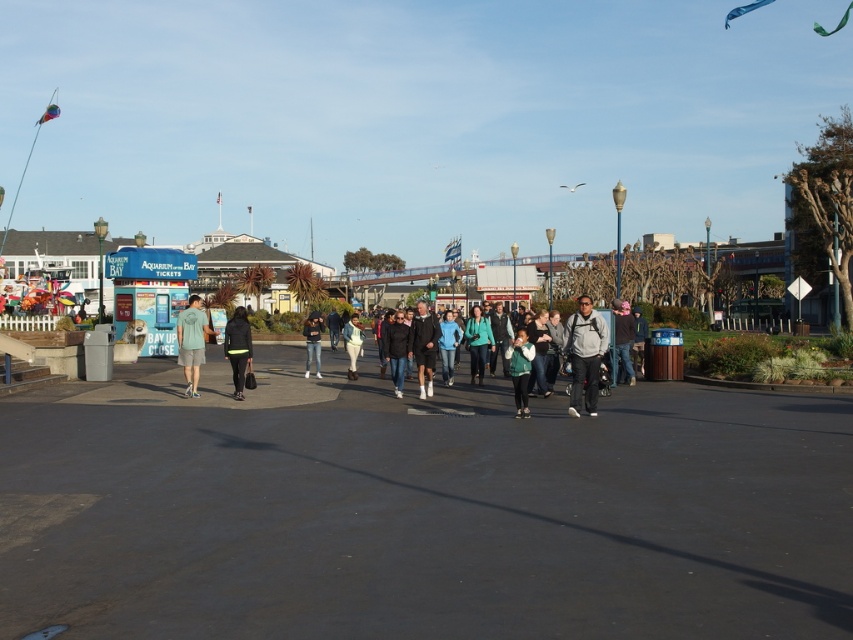
You are a photographer trying to capture both the matte green shirt at center and the dark gray jacket at center in the same frame. Since you want to emphasize the smaller object, which one should you focus on to ensure it stands out more in the photo?

The matte green shirt at center has a smaller size compared to the dark gray jacket at center, so focusing on the matte green shirt at center will help it stand out more in the photo.

You are standing at the edge of the plaza and see both the dark gray jacket at center and the dark gray hoodie at center. If you want to reach both items without moving more than 5 meters from your current position, can you do it?

The dark gray jacket at center is 4.16 meters away from the dark gray hoodie at center. Since the maximum distance you can move is 5 meters, you can reach both items within the 5 meter limit.

You are a photographer trying to capture a candid shot of the matte green shirt at center and the dark gray jacket at center. Since you want both subjects to be in focus, which one should you focus on first to ensure the other is also in sharp detail?

The matte green shirt at center is in front of the dark gray jacket at center. To ensure both are in focus, you should focus on the matte green shirt at center first, as it is closer to the camera, allowing the dark gray jacket at center in the background to also be sharp.